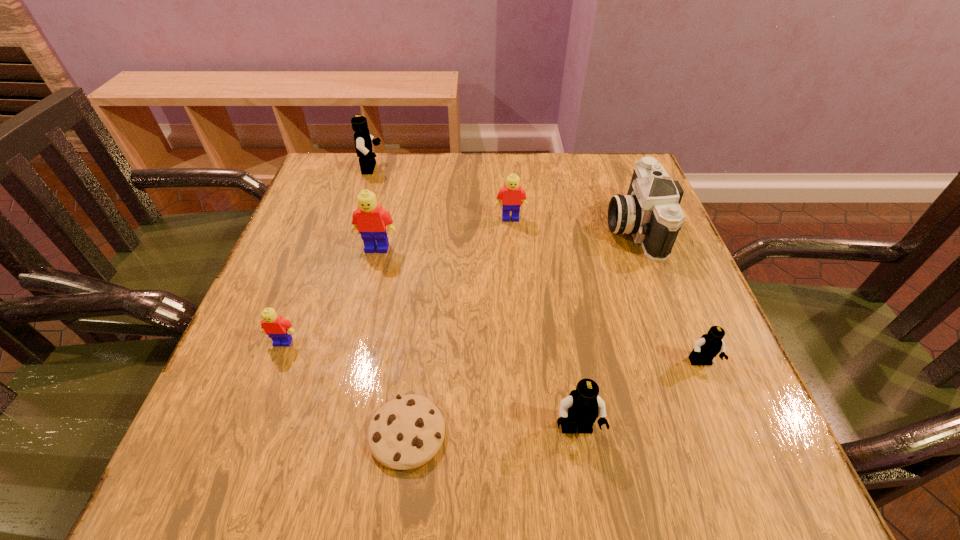
This screenshot has height=540, width=960. Identify the location of blank space located 0.150m on the front-facing side of the second nearest Lego. (740, 460).

I want to click on vacant space positioned on the back of the brown cookie, so click(x=422, y=305).

What are the coordinates of `Lego that is positioned at the far edge` in the screenshot? It's located at (363, 140).

The image size is (960, 540). I want to click on camera present at the far edge, so click(x=650, y=211).

At what (x,y) coordinates should I click in order to perform the action: click on Lego that is at the near edge. Please return your answer as a coordinate pair (x, y). The height and width of the screenshot is (540, 960). Looking at the image, I should click on click(580, 409).

Where is `cookie situated at the near edge`? This screenshot has height=540, width=960. cookie situated at the near edge is located at coordinates (405, 433).

Where is `camera that is at the right edge`? Image resolution: width=960 pixels, height=540 pixels. camera that is at the right edge is located at coordinates (650, 211).

At what (x,y) coordinates should I click in order to perform the action: click on Lego positioned at the right edge. Please return your answer as a coordinate pair (x, y). Looking at the image, I should click on (709, 345).

The width and height of the screenshot is (960, 540). What are the coordinates of `object that is positioned at the far left corner` in the screenshot? It's located at (363, 140).

The height and width of the screenshot is (540, 960). Find the location of `object that is at the far right corner`. object that is at the far right corner is located at coordinates (650, 211).